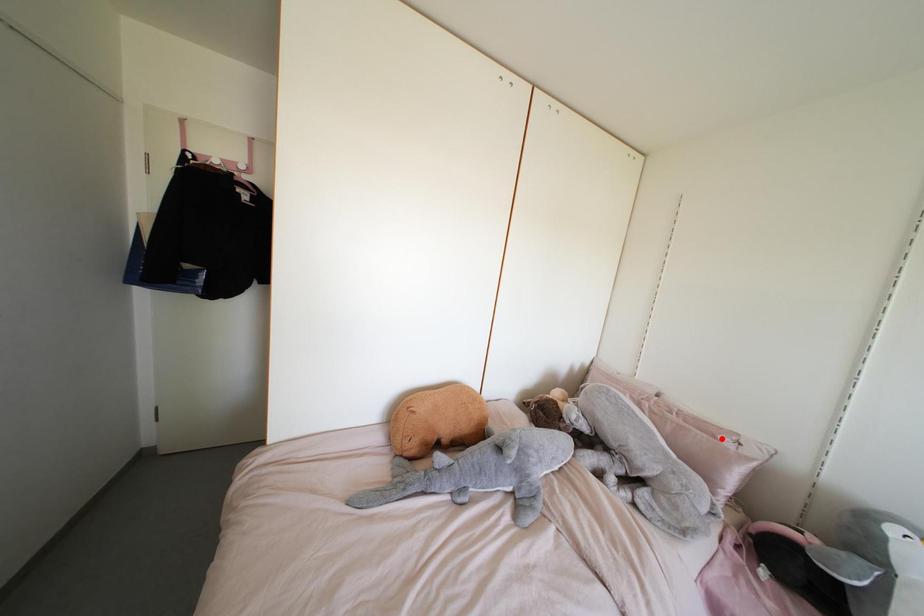
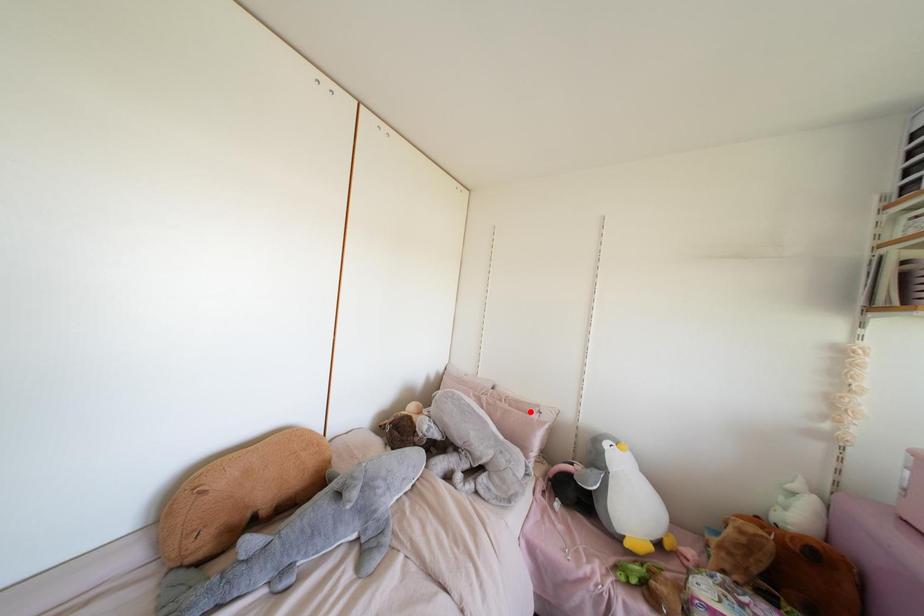
I am providing you with two images of the same scene from different viewpoints. A red point is marked on the first image and another point is marked on the second image. Is the marked point in image1 the same physical position as the marked point in image2?

Yes